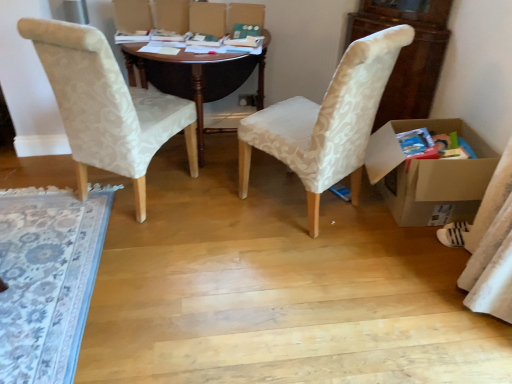
Question: From the image's perspective, is dark wood desk at center located above or below matte white fabric chair at left, marked as the first chair in a left-to-right arrangement?

Choices:
 (A) above
 (B) below

Answer: (A)

Question: Based on their positions, is dark wood desk at center located to the left or right of matte white fabric chair at left, which is counted as the 2th chair, starting from the right?

Choices:
 (A) left
 (B) right

Answer: (B)

Question: Estimate the real-world distances between objects in this image. Which object is farther from the white fabric sock at lower right?

Choices:
 (A) dark wood desk at center
 (B) patterned fabric rug at left
 (C) matte beige fabric chair at center, marked as the second chair in a left-to-right arrangement
 (D) cardboard box at right
 (E) matte white fabric chair at left, which is counted as the 2th chair, starting from the right

Answer: (B)

Question: Which is farther from the matte beige fabric chair at center, marked as the 1th chair in a right-to-left arrangement?

Choices:
 (A) matte white fabric chair at left, which is counted as the 2th chair, starting from the right
 (B) dark wood desk at center
 (C) patterned fabric rug at left
 (D) white fabric sock at lower right
 (E) cardboard box at right

Answer: (C)